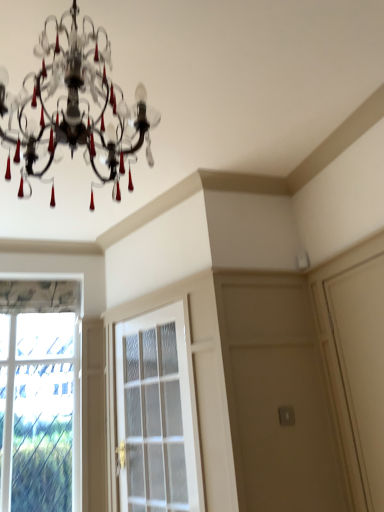
Question: Does white glass screen door at center have a lesser width compared to clear glass window at left?

Choices:
 (A) yes
 (B) no

Answer: (B)

Question: Does white glass screen door at center have a greater height compared to clear glass window at left?

Choices:
 (A) no
 (B) yes

Answer: (A)

Question: From the image's perspective, is white glass screen door at center above clear glass window at left?

Choices:
 (A) no
 (B) yes

Answer: (B)

Question: Does white glass screen door at center turn towards clear glass window at left?

Choices:
 (A) no
 (B) yes

Answer: (A)

Question: From a real-world perspective, is white glass screen door at center positioned over clear glass window at left based on gravity?

Choices:
 (A) yes
 (B) no

Answer: (B)

Question: Is white glass screen door at center not close to clear glass window at left?

Choices:
 (A) no
 (B) yes

Answer: (A)

Question: From a real-world perspective, does clear glass window at left sit lower than matte black chandelier at upper center?

Choices:
 (A) yes
 (B) no

Answer: (A)

Question: From the image's perspective, is clear glass window at left below matte black chandelier at upper center?

Choices:
 (A) yes
 (B) no

Answer: (A)

Question: Can matte black chandelier at upper center be found inside clear glass window at left?

Choices:
 (A) no
 (B) yes

Answer: (A)

Question: Considering the relative sizes of clear glass window at left and matte black chandelier at upper center in the image provided, is clear glass window at left smaller than matte black chandelier at upper center?

Choices:
 (A) yes
 (B) no

Answer: (A)

Question: Considering the relative positions of clear glass window at left and matte black chandelier at upper center in the image provided, is clear glass window at left behind matte black chandelier at upper center?

Choices:
 (A) no
 (B) yes

Answer: (B)

Question: From a real-world perspective, is clear glass window at left physically above matte black chandelier at upper center?

Choices:
 (A) yes
 (B) no

Answer: (B)

Question: Is clear glass window at left touching white glass screen door at center?

Choices:
 (A) no
 (B) yes

Answer: (A)